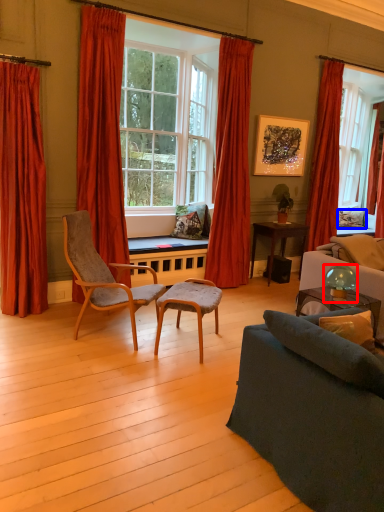
Question: Which of the following is the closest to the observer, lamp (highlighted by a red box) or pillow (highlighted by a blue box)?

Choices:
 (A) lamp
 (B) pillow

Answer: (A)